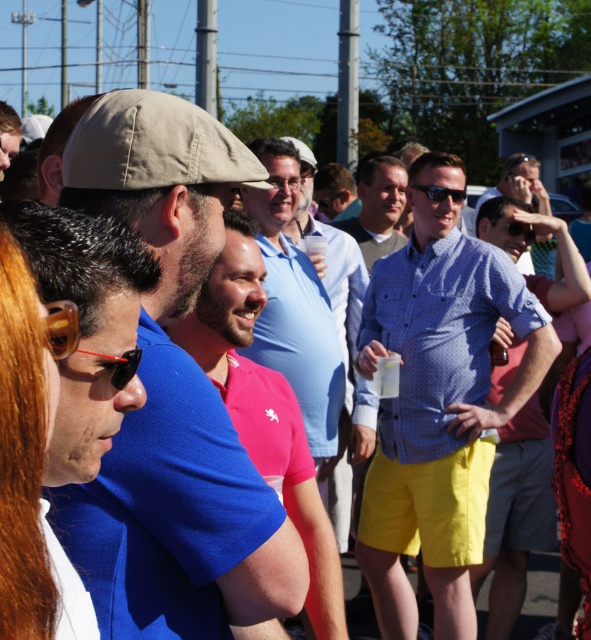
Is matte black cap at upper left to the left of matte black sunglasses at center from the viewer's perspective?

Indeed, matte black cap at upper left is positioned on the left side of matte black sunglasses at center.

Who is shorter, matte black cap at upper left or matte black sunglasses at center?

With less height is matte black sunglasses at center.

Does point (1, 118) come closer to viewer compared to point (427, 186)?

No, (1, 118) is behind (427, 186).

Locate an element on the screen. matte black cap at upper left is located at coordinates (8, 136).

Who is taller, matte khaki cap at center or matte black sunglasses at center?

matte khaki cap at center

Is matte khaki cap at center to the right of matte black sunglasses at center from the viewer's perspective?

No, matte khaki cap at center is not to the right of matte black sunglasses at center.

Which is behind, point (196, 128) or point (447, 195)?

The point (447, 195) is more distant.

Find the location of `matte khaki cap at center`. matte khaki cap at center is located at coordinates (173, 396).

Does blue dotted shirt at center appear over matte black sunglasses at center?

Actually, blue dotted shirt at center is below matte black sunglasses at center.

Locate an element on the screen. blue dotted shirt at center is located at coordinates (439, 404).